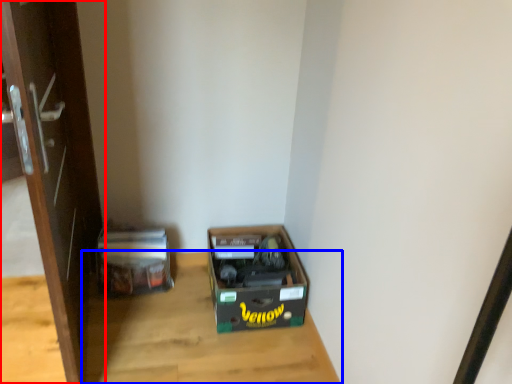
Question: Which object is further to the camera taking this photo, door (highlighted by a red box) or table (highlighted by a blue box)?

Choices:
 (A) door
 (B) table

Answer: (B)